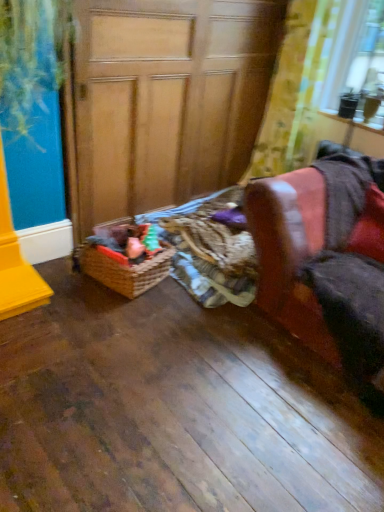
Where is `yellow floral fabric at upper right`? This screenshot has width=384, height=512. yellow floral fabric at upper right is located at coordinates pyautogui.click(x=294, y=88).

Does point (182, 139) appear closer or farther from the camera than point (143, 281)?

Clearly, point (182, 139) is more distant from the camera than point (143, 281).

Is woven brown basket at lower center completely or partially inside wooden at left?

No, woven brown basket at lower center is not a part of wooden at left.

In the scene shown: Does wooden at left have a smaller size compared to woven brown basket at lower center?

No.

Considering the relative sizes of wooden at left and woven brown basket at lower center in the image provided, is wooden at left wider than woven brown basket at lower center?

Yes, wooden at left is wider than woven brown basket at lower center.

Looking at their sizes, would you say wooden at left is wider or thinner than leather armchair at right?

Considering their sizes, wooden at left looks slimmer than leather armchair at right.

Does wooden at left turn towards leather armchair at right?

Yes.

Considering the positions of point (90, 73) and point (352, 267), is point (90, 73) closer or farther from the camera than point (352, 267)?

Point (90, 73) appears to be closer to the viewer than point (352, 267).

From the image's perspective, between wooden at left and yellow floral fabric at upper right, who is located below?

wooden at left.

Considering the sizes of objects wooden at left and yellow floral fabric at upper right in the image provided, who is taller, wooden at left or yellow floral fabric at upper right?

wooden at left.

Locate an element on the screen. The height and width of the screenshot is (512, 384). curtain located behind the wooden at left is located at coordinates (294, 88).

Is wooden at left not near yellow floral fabric at upper right?

No, wooden at left is not far away from yellow floral fabric at upper right.

Is yellow floral fabric at upper right touching wooden at left?

No, yellow floral fabric at upper right is not beside wooden at left.

How different are the orientations of yellow floral fabric at upper right and wooden at left in degrees?

90.2 degrees separate the facing orientations of yellow floral fabric at upper right and wooden at left.

Is yellow floral fabric at upper right spatially inside wooden at left, or outside of it?

yellow floral fabric at upper right exists outside the volume of wooden at left.

From the image's perspective, which is below, yellow floral fabric at upper right or wooden at left?

From the image's view, wooden at left is below.

From a real-world perspective, who is located lower, leather armchair at right or yellow floral fabric at upper right?

leather armchair at right.

Could you tell me if leather armchair at right is turned towards yellow floral fabric at upper right?

No.

Is point (356, 204) closer to camera compared to point (300, 8)?

That is True.

Can you confirm if leather armchair at right is thinner than yellow floral fabric at upper right?

No.

What's the angular difference between leather armchair at right and wooden at left's facing directions?

The angle between the facing direction of leather armchair at right and the facing direction of wooden at left is 89.8 degrees.

Locate an element on the screen. screen door located behind the leather armchair at right is located at coordinates (164, 101).

From the image's perspective, who appears lower, leather armchair at right or wooden at left?

From the image's view, leather armchair at right is below.

Looking at this image, considering the relative positions of leather armchair at right and wooden at left in the image provided, is leather armchair at right behind wooden at left?

That is False.

From the image's perspective, is leather armchair at right beneath woven brown basket at lower center?

No, from the image's perspective, leather armchair at right is not beneath woven brown basket at lower center.

Can you confirm if leather armchair at right is taller than woven brown basket at lower center?

Correct, leather armchair at right is much taller as woven brown basket at lower center.

The width and height of the screenshot is (384, 512). Find the location of `screen door in front of the woven brown basket at lower center`. screen door in front of the woven brown basket at lower center is located at coordinates [164, 101].

Where is `armchair below the wooden at left (from a real-world perspective)`? The width and height of the screenshot is (384, 512). armchair below the wooden at left (from a real-world perspective) is located at coordinates 323,264.

From the image, which object appears to be farther from leather armchair at right, woven brown basket at lower center or yellow floral fabric at upper right?

The object further to leather armchair at right is yellow floral fabric at upper right.

Considering their positions, is leather armchair at right positioned further to wooden at left than woven brown basket at lower center?

Based on the image, leather armchair at right appears to be further to wooden at left.

Consider the image. Considering their positions, is woven brown basket at lower center positioned closer to yellow floral fabric at upper right than wooden at left?

The object closer to yellow floral fabric at upper right is wooden at left.

Based on their spatial positions, is leather armchair at right or wooden at left further from yellow floral fabric at upper right?

leather armchair at right.

Looking at the image, which one is located closer to leather armchair at right, wooden at left or woven brown basket at lower center?

Among the two, woven brown basket at lower center is located nearer to leather armchair at right.

Looking at the image, which one is located closer to yellow floral fabric at upper right, wooden at left or woven brown basket at lower center?

The object closer to yellow floral fabric at upper right is wooden at left.

Looking at the image, which one is located closer to yellow floral fabric at upper right, wooden at left or leather armchair at right?

wooden at left is closer to yellow floral fabric at upper right.

From the image, which object appears to be nearer to woven brown basket at lower center, yellow floral fabric at upper right or leather armchair at right?

leather armchair at right.

I want to click on screen door between woven brown basket at lower center and leather armchair at right, so click(164, 101).

Locate an element on the screen. This screenshot has height=512, width=384. screen door that lies between yellow floral fabric at upper right and leather armchair at right from top to bottom is located at coordinates click(x=164, y=101).

Identify the location of screen door between yellow floral fabric at upper right and woven brown basket at lower center from top to bottom. The width and height of the screenshot is (384, 512). (164, 101).

Where is `curtain between woven brown basket at lower center and leather armchair at right in the horizontal direction`? curtain between woven brown basket at lower center and leather armchair at right in the horizontal direction is located at coordinates (294, 88).